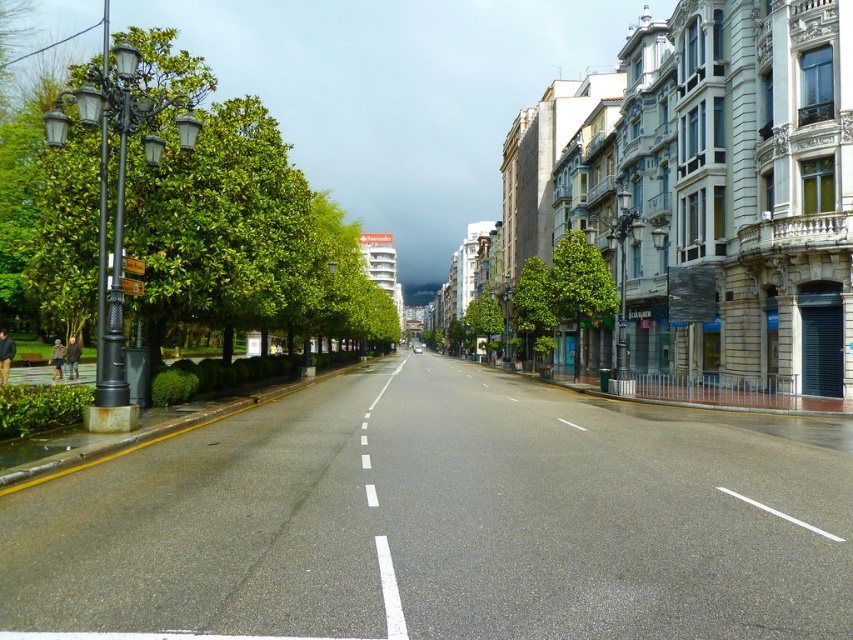
Question: Among these points, which one is nearest to the camera?

Choices:
 (A) (212, 234)
 (B) (548, 342)

Answer: (A)

Question: Which of the following is the farthest from the observer?

Choices:
 (A) green leafy tree at center
 (B) green leafy tree at left

Answer: (A)

Question: Which object appears closest to the camera in this image?

Choices:
 (A) green leafy tree at left
 (B) green leafy tree at center

Answer: (A)

Question: Is the position of green leafy tree at left less distant than that of green leafy tree at center?

Choices:
 (A) yes
 (B) no

Answer: (A)

Question: Can you confirm if green leafy tree at left is positioned to the right of green leafy tree at center?

Choices:
 (A) no
 (B) yes

Answer: (A)

Question: Is green leafy tree at left below green leafy tree at center?

Choices:
 (A) yes
 (B) no

Answer: (B)